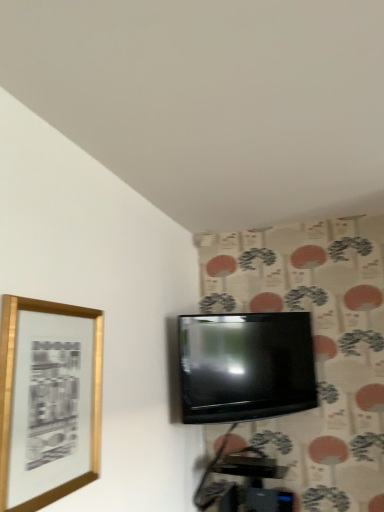
Question: Considering their positions, is gold metallic picture frame at left located in front of or behind black glossy tv at center?

Choices:
 (A) behind
 (B) front

Answer: (B)

Question: From the image's perspective, is gold metallic picture frame at left located above or below black glossy tv at center?

Choices:
 (A) below
 (B) above

Answer: (B)

Question: In terms of size, does gold metallic picture frame at left appear bigger or smaller than black glossy tv at center?

Choices:
 (A) small
 (B) big

Answer: (A)

Question: Considering the positions of black glossy tv at center and gold metallic picture frame at left in the image, is black glossy tv at center taller or shorter than gold metallic picture frame at left?

Choices:
 (A) tall
 (B) short

Answer: (B)

Question: From a real-world perspective, is black glossy tv at center positioned above or below gold metallic picture frame at left?

Choices:
 (A) above
 (B) below

Answer: (A)

Question: Would you say black glossy tv at center is inside or outside gold metallic picture frame at left?

Choices:
 (A) inside
 (B) outside

Answer: (B)

Question: Is black glossy tv at center bigger or smaller than gold metallic picture frame at left?

Choices:
 (A) big
 (B) small

Answer: (A)